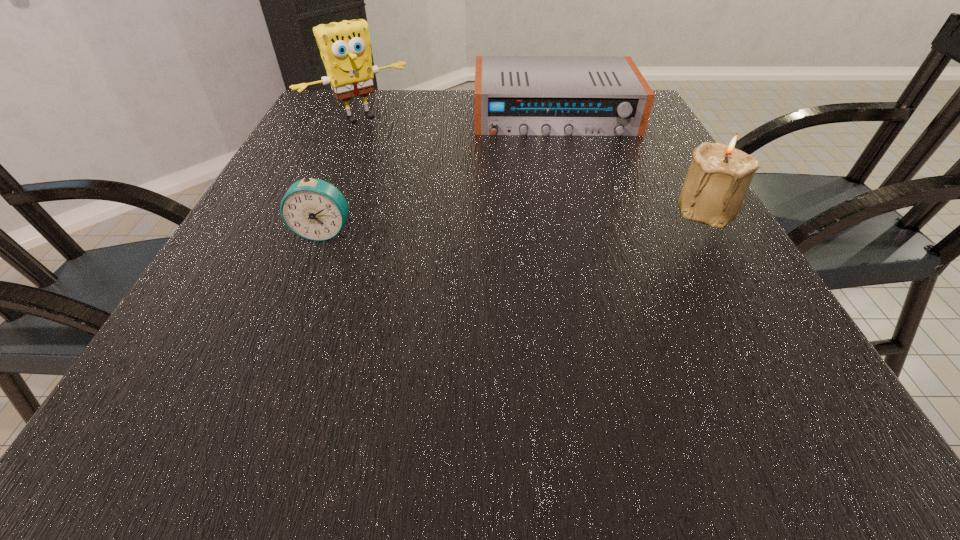
Image resolution: width=960 pixels, height=540 pixels. In order to click on free space between the sponge and the candle_holder in this screenshot , I will do `click(535, 163)`.

Locate an element on the screen. The image size is (960, 540). blank region between the alarm clock and the radio receiver is located at coordinates (440, 173).

Identify the location of free space between the radio receiver and the alarm clock. This screenshot has width=960, height=540. (440, 173).

In order to click on free space between the alarm clock and the sponge in this screenshot , I will do `click(342, 175)`.

Choose which object is the third nearest neighbor to the alarm clock. Please provide its 2D coordinates. Your answer should be formatted as a tuple, i.e. [(x, y)], where the tuple contains the x and y coordinates of a point satisfying the conditions above.

[(713, 193)]

Find the location of a particular element. The width and height of the screenshot is (960, 540). object that is the third closest to the alarm clock is located at coordinates (713, 193).

The width and height of the screenshot is (960, 540). I want to click on vacant point that satisfies the following two spatial constraints: 1. on the front side of the candle_holder; 2. on the right side of the shortest object, so click(579, 208).